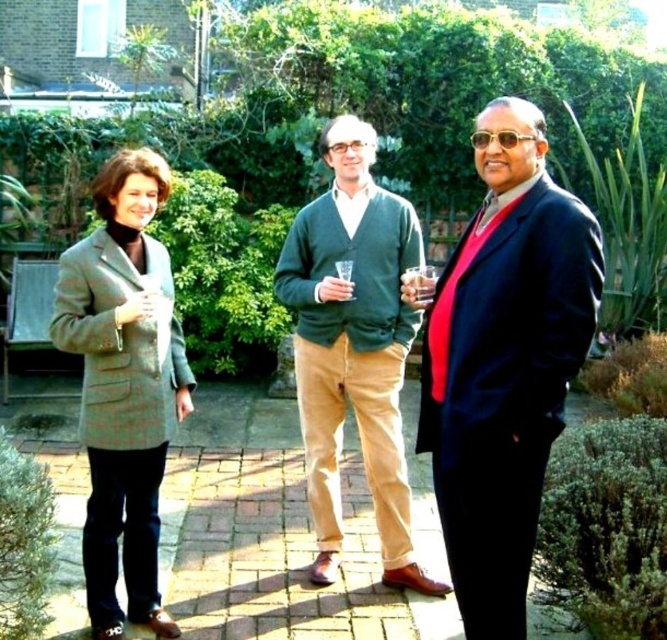
Is point (462, 435) positioned behind point (412, 292)?

No, (462, 435) is in front of (412, 292).

Does navy blue suit at center have a greater width compared to translucent plastic cup at center?

Indeed, navy blue suit at center has a greater width compared to translucent plastic cup at center.

You are a GUI agent. You are given a task and a screenshot of the screen. Output one action in this format:
    pyautogui.click(x=<x>, y=<y>)
    Task: Click on the navy blue suit at center
    
    Given the screenshot: What is the action you would take?
    pyautogui.click(x=504, y=362)

At what (x,y) coordinates should I click in order to perform the action: click on navy blue suit at center. Please return your answer as a coordinate pair (x, y). Looking at the image, I should click on (504, 362).

Does plaid wool coat at left have a lesser width compared to translucent plastic cup at center?

No, plaid wool coat at left is not thinner than translucent plastic cup at center.

Is plaid wool coat at left above translucent plastic cup at center?

No, plaid wool coat at left is not above translucent plastic cup at center.

Is point (161, 632) closer to camera compared to point (428, 275)?

No, it is behind (428, 275).

In order to click on plaid wool coat at left in this screenshot , I will do `click(123, 385)`.

Measure the distance between point (496, 120) and camera.

Point (496, 120) and camera are 3.12 meters apart.

Is navy blue suit at center taller than plaid wool coat at left?

No, navy blue suit at center is not taller than plaid wool coat at left.

Who is more distant from viewer, (x=476, y=301) or (x=157, y=353)?

The point (x=157, y=353) is behind.

Where is `navy blue suit at center`? This screenshot has width=667, height=640. navy blue suit at center is located at coordinates (504, 362).